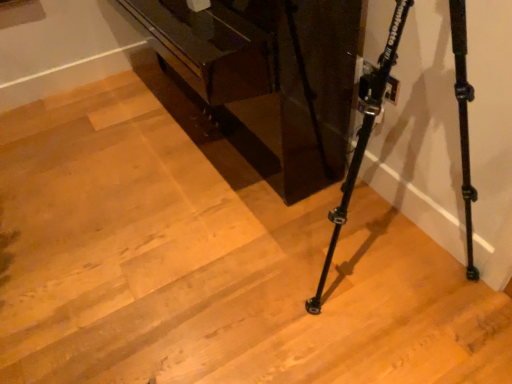
Question: Would you say glossy dark wood piano at center is to the left or to the right of black matte tripod at lower right in the picture?

Choices:
 (A) right
 (B) left

Answer: (B)

Question: From a real-world perspective, is glossy dark wood piano at center positioned above or below black matte tripod at lower right?

Choices:
 (A) below
 (B) above

Answer: (A)

Question: Is glossy dark wood piano at center situated inside black matte tripod at lower right or outside?

Choices:
 (A) outside
 (B) inside

Answer: (A)

Question: Considering the positions of black matte tripod at lower right and glossy dark wood piano at center in the image, is black matte tripod at lower right taller or shorter than glossy dark wood piano at center?

Choices:
 (A) tall
 (B) short

Answer: (A)

Question: Considering the positions of point (459, 51) and point (350, 26), is point (459, 51) closer or farther from the camera than point (350, 26)?

Choices:
 (A) closer
 (B) farther

Answer: (A)

Question: Is black matte tripod at lower right in front of or behind glossy dark wood piano at center in the image?

Choices:
 (A) behind
 (B) front

Answer: (B)

Question: Is black matte tripod at lower right spatially inside glossy dark wood piano at center, or outside of it?

Choices:
 (A) outside
 (B) inside

Answer: (A)